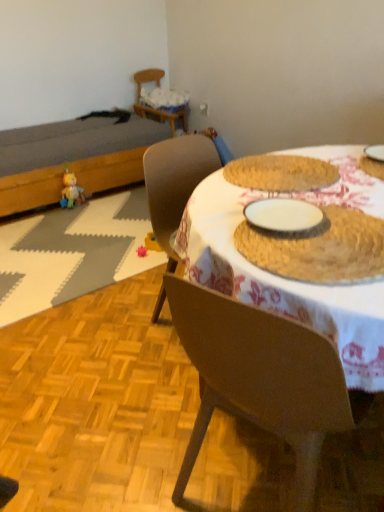
Question: Do you think wooden chair at upper left, which appears as the first chair when viewed from the left, is within brown matte chair at center, which is the first chair from bottom to top, or outside of it?

Choices:
 (A) inside
 (B) outside

Answer: (B)

Question: Relative to brown matte chair at center, the 2th chair when ordered from back to front, is wooden chair at upper left, which is the 2th chair from bottom to top, in front or behind?

Choices:
 (A) front
 (B) behind

Answer: (B)

Question: Which object is positioned farthest from the white woven placemat at left?

Choices:
 (A) wooden chair at upper left, the 2th chair from the front
 (B) pink fabric toy at lower center, which ranks as the second toy in left-to-right order
 (C) brown woven placemat at center
 (D) dark brown wooden bed at left
 (E) plush yellow duck at left, the 1th toy when ordered from back to front

Answer: (C)

Question: Based on their relative distances, which object is farther from the wooden chair at upper left, the first chair from the back?

Choices:
 (A) white woven placemat at left
 (B) brown matte chair at center, arranged as the 1th chair when viewed from the front
 (C) pink fabric toy at lower center, arranged as the first toy when viewed from the right
 (D) plush yellow duck at left, the 2th toy when ordered from bottom to top
 (E) brown wood table at center

Answer: (B)